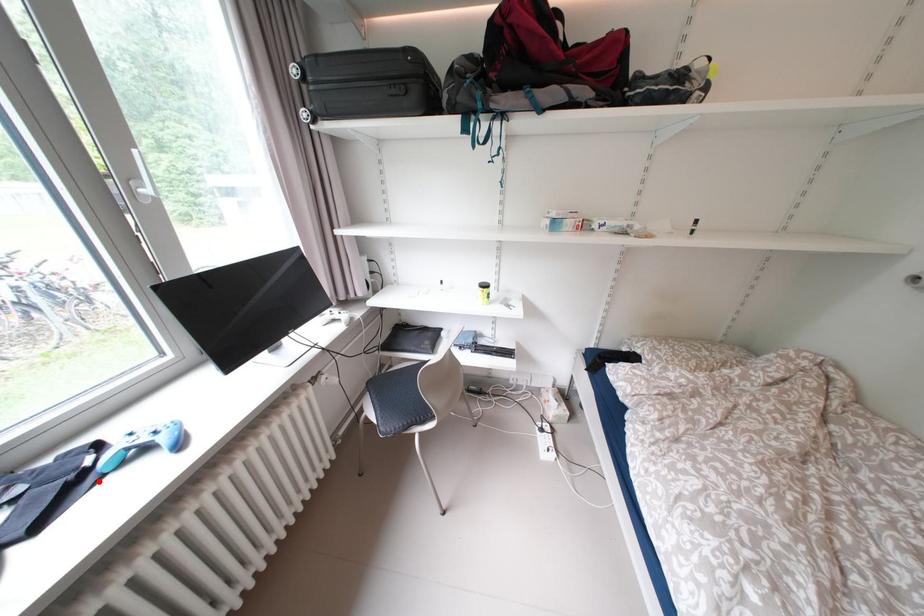
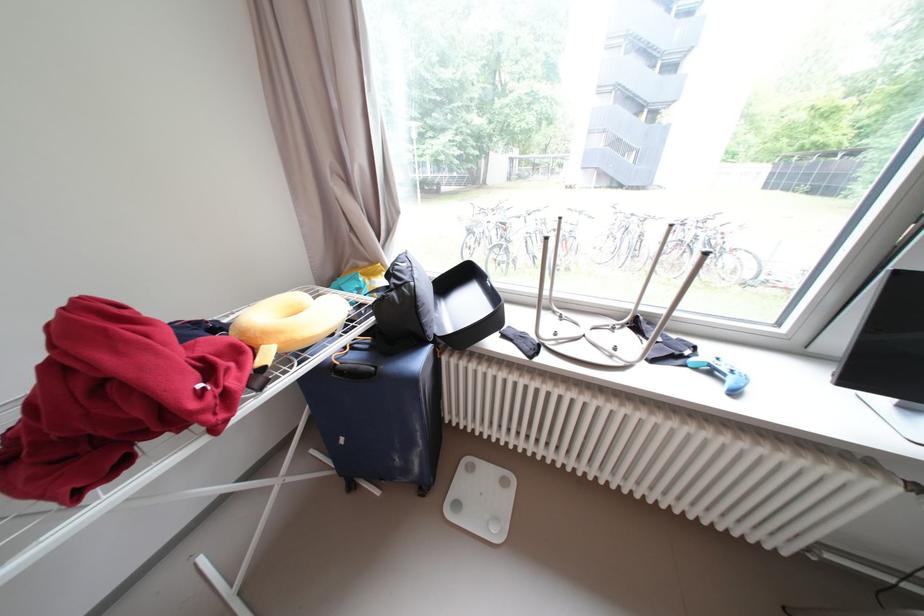
Where in the second image is the point corresponding to the highlighted location from the first image?

(688, 363)